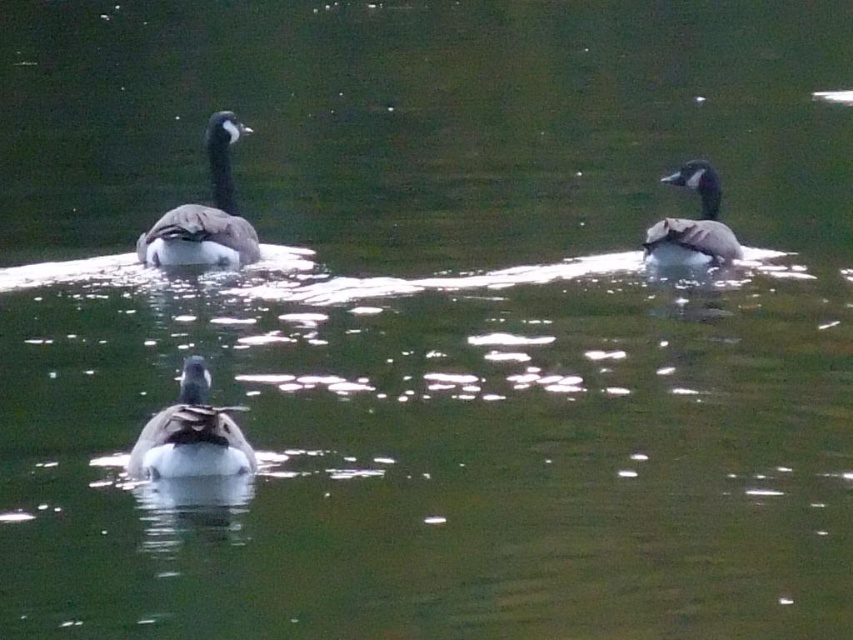
Is point (224, 220) more distant than point (650, 234)?

No, (224, 220) is in front of (650, 234).

This screenshot has width=853, height=640. Find the location of `dark gray matte duck at upper left`. dark gray matte duck at upper left is located at coordinates (206, 214).

Does dark gray matte duck at center appear on the left side of dark gray matte duck at upper left?

No, dark gray matte duck at center is not to the left of dark gray matte duck at upper left.

The height and width of the screenshot is (640, 853). In order to click on dark gray matte duck at center in this screenshot , I will do click(x=190, y=435).

Between point (170, 412) and point (715, 182), which one is positioned behind?

The point (715, 182) is more distant.

Image resolution: width=853 pixels, height=640 pixels. What do you see at coordinates (190, 435) in the screenshot?
I see `dark gray matte duck at center` at bounding box center [190, 435].

Find the location of a particular element. The width and height of the screenshot is (853, 640). dark gray matte duck at center is located at coordinates (190, 435).